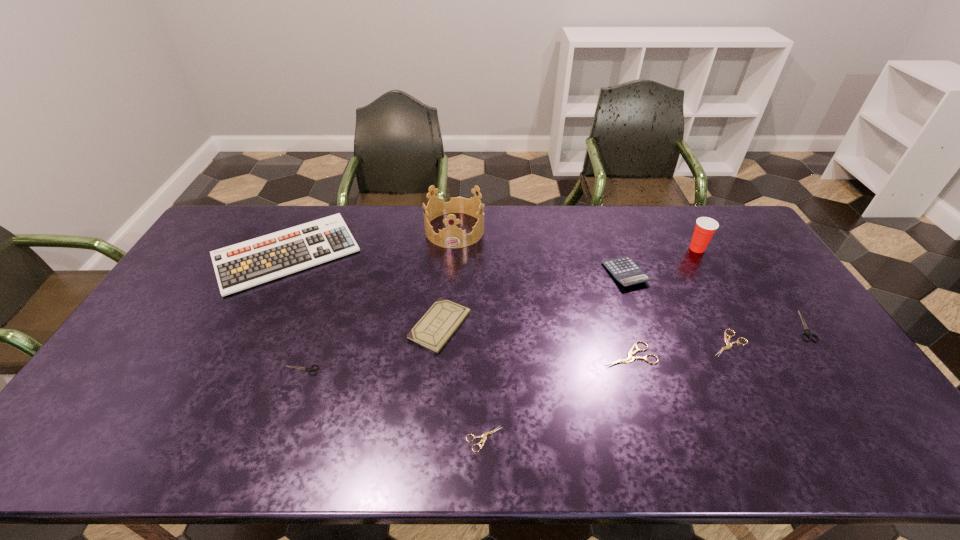
At what (x,y) coordinates should I click in order to perform the action: click on object that is at the near edge. Please return your answer as a coordinate pair (x, y). The height and width of the screenshot is (540, 960). Looking at the image, I should click on (484, 435).

You are a GUI agent. You are given a task and a screenshot of the screen. Output one action in this format:
    pyautogui.click(x=<x>, y=<y>)
    Task: Click on the object located in the left edge section of the desktop
    This screenshot has width=960, height=540.
    Given the screenshot: What is the action you would take?
    pyautogui.click(x=243, y=265)

This screenshot has height=540, width=960. Find the location of `object positioned at the right edge`. object positioned at the right edge is located at coordinates (807, 332).

Identify the location of object located at the far left corner. (243, 265).

You are a GUI agent. You are given a task and a screenshot of the screen. Output one action in this format:
    pyautogui.click(x=<x>, y=<y>)
    Task: Click on the vacant space at the far edge
    The height and width of the screenshot is (540, 960).
    Given the screenshot: What is the action you would take?
    pyautogui.click(x=440, y=222)

In the image, there is a desktop. Identify the location of blank space at the near edge. (179, 441).

Locate an element on the screen. This screenshot has width=960, height=540. free space at the left edge is located at coordinates (194, 294).

Locate an element on the screen. vacant space at the right edge of the desktop is located at coordinates (800, 311).

The image size is (960, 540). In the image, there is a desktop. What are the coordinates of `vacant space at the far left corner` in the screenshot? It's located at (252, 225).

The height and width of the screenshot is (540, 960). Identify the location of free location at the far right corner of the desktop. (733, 235).